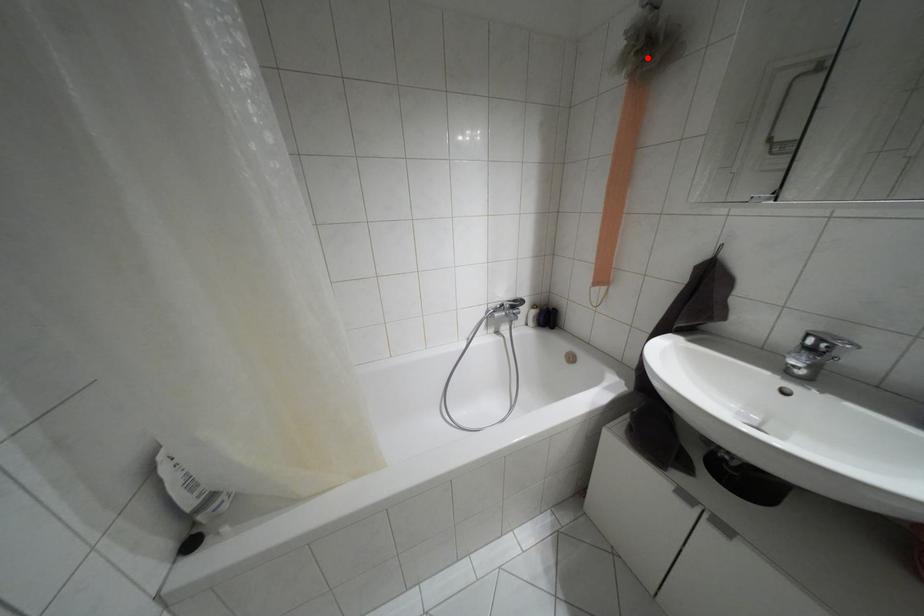
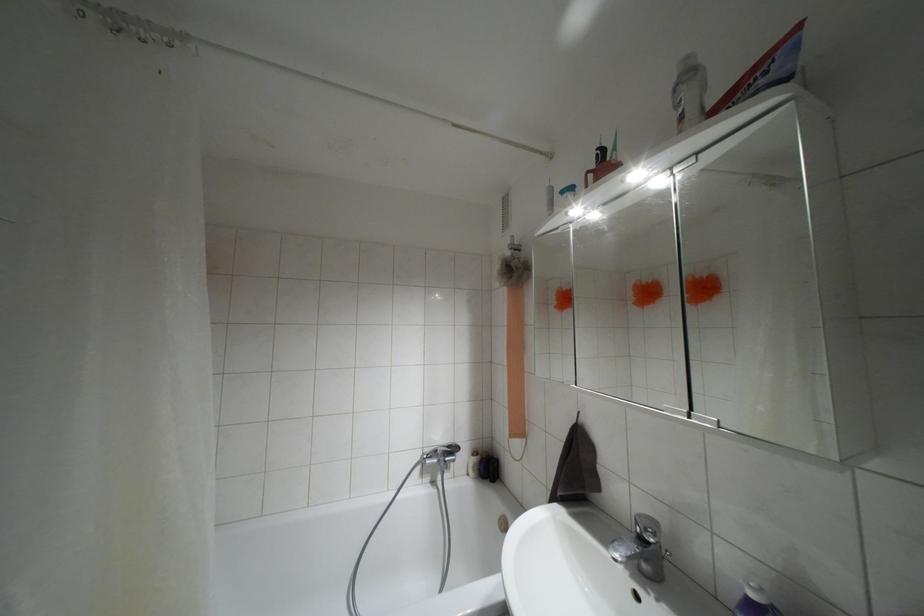
In the second image, find the point that corresponds to the highlighted location in the first image.

(509, 277)